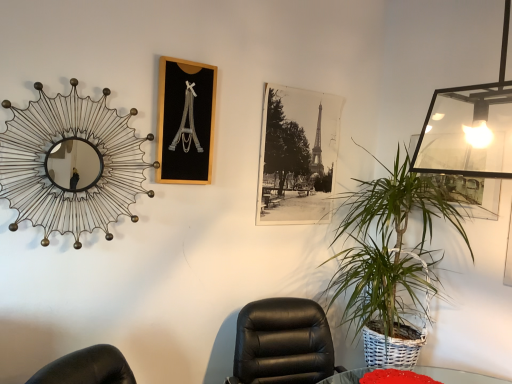
Question: Which direction should I rotate to look at black wood picture frame at upper center, the 1th picture frame when ordered from left to right, — up or down?

Choices:
 (A) down
 (B) up

Answer: (B)

Question: Is black leather chair at center outside metallic wire mirror at upper left?

Choices:
 (A) no
 (B) yes

Answer: (B)

Question: Is black leather chair at center at the left side of metallic wire mirror at upper left?

Choices:
 (A) yes
 (B) no

Answer: (B)

Question: Does black leather chair at center come behind metallic wire mirror at upper left?

Choices:
 (A) no
 (B) yes

Answer: (A)

Question: Is metallic wire mirror at upper left at the back of black leather chair at center?

Choices:
 (A) yes
 (B) no

Answer: (B)

Question: Considering the relative sizes of black leather chair at center and metallic wire mirror at upper left in the image provided, is black leather chair at center smaller than metallic wire mirror at upper left?

Choices:
 (A) yes
 (B) no

Answer: (B)

Question: Is black leather chair at center touching metallic wire mirror at upper left?

Choices:
 (A) yes
 (B) no

Answer: (B)

Question: Is black wood picture frame at upper center, the 1th picture frame when ordered from left to right, aimed at metallic wire mirror at upper left?

Choices:
 (A) no
 (B) yes

Answer: (A)

Question: Does black wood picture frame at upper center, marked as the second picture frame in a right-to-left arrangement, have a smaller size compared to metallic wire mirror at upper left?

Choices:
 (A) yes
 (B) no

Answer: (A)

Question: Is black wood picture frame at upper center, marked as the second picture frame in a right-to-left arrangement, facing away from metallic wire mirror at upper left?

Choices:
 (A) no
 (B) yes

Answer: (A)

Question: Can you see black wood picture frame at upper center, arranged as the first picture frame when viewed from the front, touching metallic wire mirror at upper left?

Choices:
 (A) yes
 (B) no

Answer: (B)

Question: Can you confirm if black wood picture frame at upper center, the 2th picture frame viewed from the back, is wider than metallic wire mirror at upper left?

Choices:
 (A) no
 (B) yes

Answer: (A)

Question: Considering the relative sizes of black wood picture frame at upper center, marked as the second picture frame in a right-to-left arrangement, and metallic wire mirror at upper left in the image provided, is black wood picture frame at upper center, marked as the second picture frame in a right-to-left arrangement, taller than metallic wire mirror at upper left?

Choices:
 (A) yes
 (B) no

Answer: (B)

Question: Is black wood picture frame at upper center, the 2th picture frame viewed from the back, thinner than black leather chair at center?

Choices:
 (A) yes
 (B) no

Answer: (A)